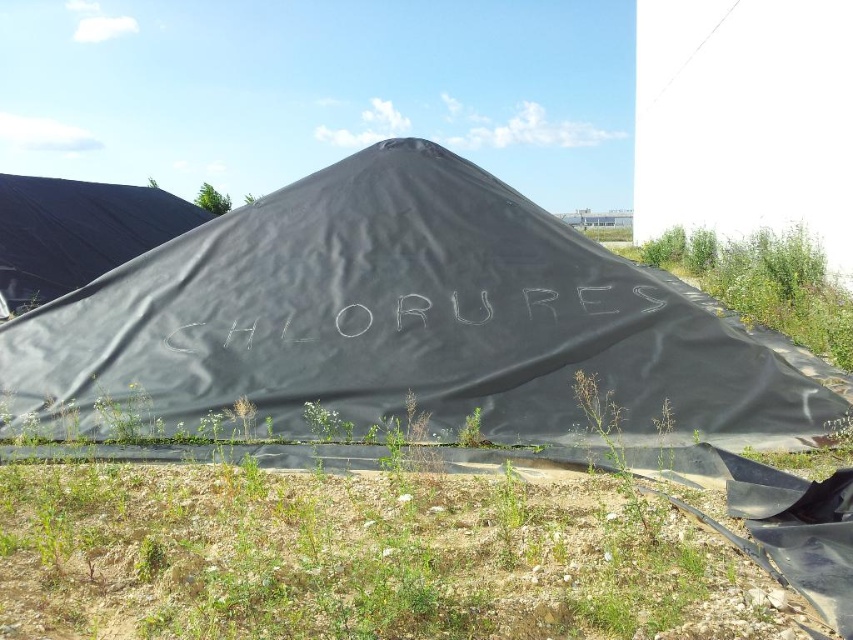
From the picture: You are standing in front of the mound covered with a black tarpaulin labeled CHLURS. You see two points marked as point 1 at coordinates [456,356] and point 2 at coordinates [607,410]. Which point is closer to you?

Point 1 at coordinates [456,356] is closer to you because it is further to the camera than point 2 at coordinates [607,410].

You are a gardener who wants to plant flowers in the green grass at lower center and the black tarp at left. Which area has more space to plant?

The green grass at lower center might be wider than the black tarp at left, so it has more space to plant flowers.

You are standing at the edge of the scene and want to walk to the green leafy plant at lower center. Which direction should you head relative to the black tarp at center?

The black tarp at center is to the left of the green leafy plant at lower center, so you should head to the right of the black tarp at center to reach the green leafy plant at lower center.